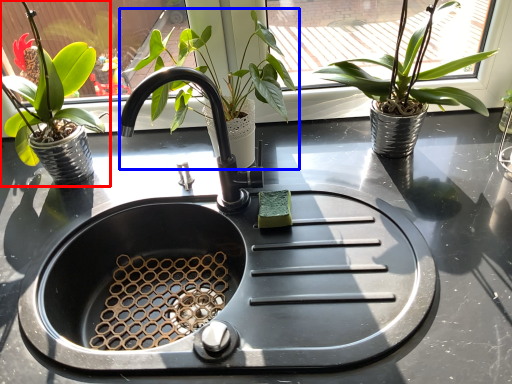
Question: Which of the following is the closest to the observer, houseplant (highlighted by a red box) or houseplant (highlighted by a blue box)?

Choices:
 (A) houseplant
 (B) houseplant

Answer: (A)